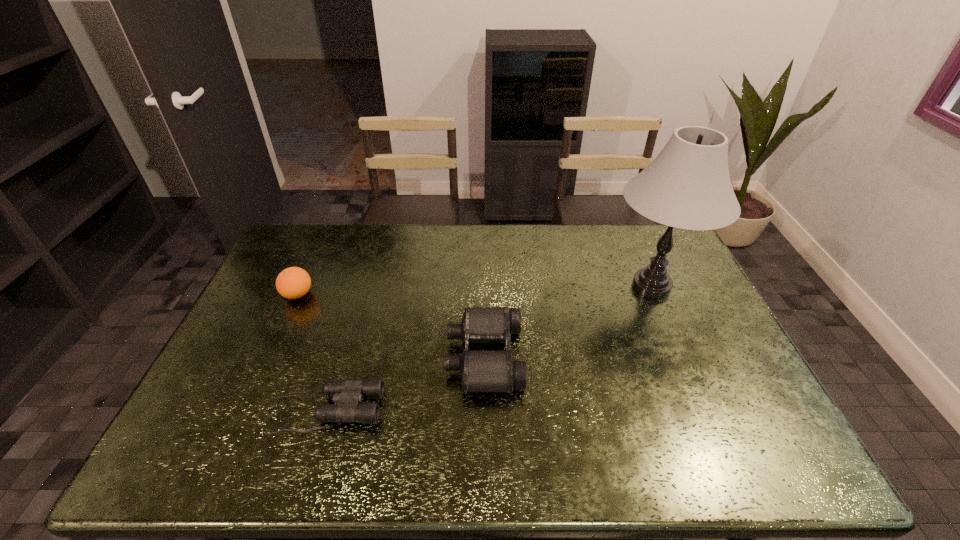
At what (x,y) coordinates should I click in order to perform the action: click on free space located through the eyepieces of the third object from left to right. Please return your answer as a coordinate pair (x, y). Looking at the image, I should click on (419, 356).

Locate an element on the screen. vacant region located through the eyepieces of the third object from left to right is located at coordinates (321, 356).

The image size is (960, 540). I want to click on vacant space located at the eyepiece of the shortest object, so click(x=542, y=410).

The width and height of the screenshot is (960, 540). Identify the location of object located at the far edge. (687, 186).

This screenshot has height=540, width=960. I want to click on object present at the left edge, so click(x=292, y=283).

Find the location of a particular element. object located at the right edge is located at coordinates tap(687, 186).

Where is `object at the far right corner`? This screenshot has width=960, height=540. object at the far right corner is located at coordinates (687, 186).

You are a GUI agent. You are given a task and a screenshot of the screen. Output one action in this format:
    pyautogui.click(x=<x>, y=<y>)
    Task: Click on the free space at the far edge of the desktop
    The width and height of the screenshot is (960, 540).
    Given the screenshot: What is the action you would take?
    pyautogui.click(x=432, y=235)

Find the location of a particular element. The image size is (960, 540). vacant region at the near edge of the desktop is located at coordinates (237, 469).

Where is `vacant space at the left edge`? This screenshot has width=960, height=540. vacant space at the left edge is located at coordinates click(x=240, y=372).